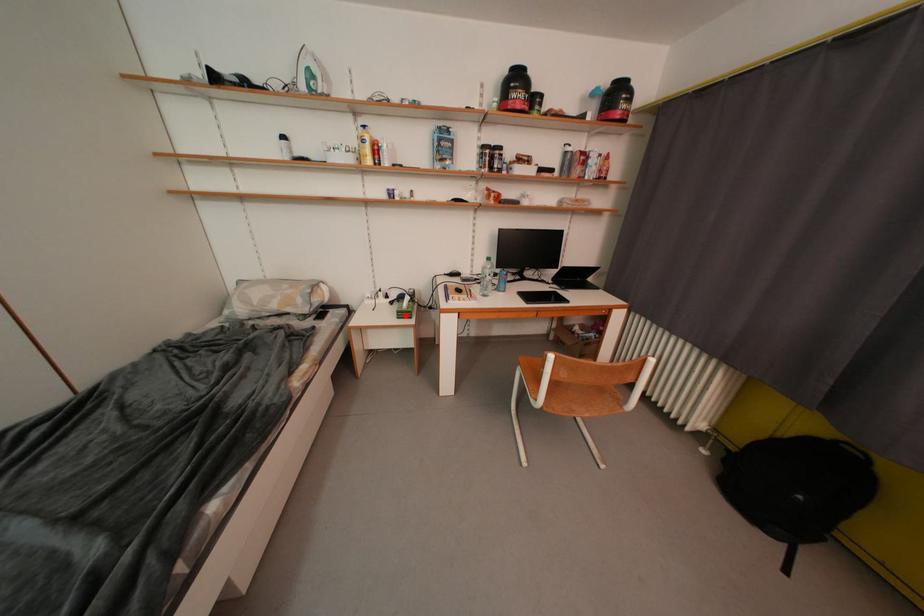
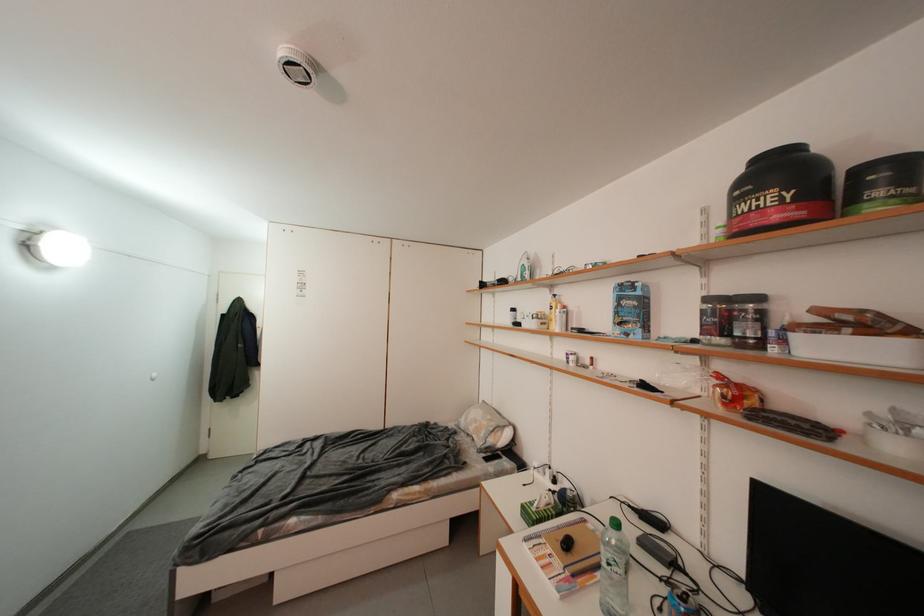
The point at the highlighted location is marked in the first image. Where is the corresponding point in the second image?

(530, 509)